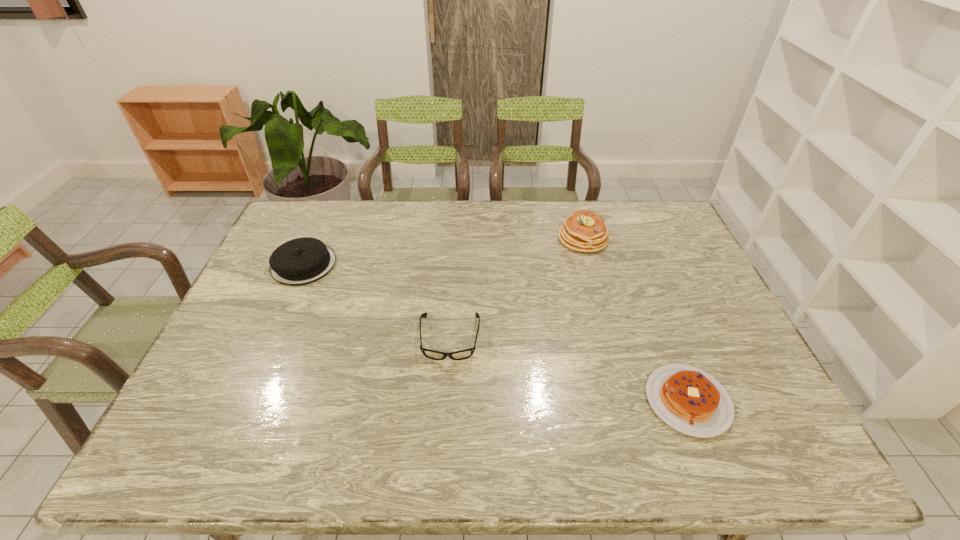
The width and height of the screenshot is (960, 540). I want to click on free space located 0.380m on the back of the shortest pancake, so click(x=636, y=268).

Identify the location of object that is at the far edge. (585, 231).

This screenshot has height=540, width=960. Identify the location of object positioned at the near edge. (691, 401).

Identify the location of object positioned at the left edge. Image resolution: width=960 pixels, height=540 pixels. (300, 261).

What are the coordinates of `object located in the right edge section of the desktop` in the screenshot? It's located at (691, 401).

Identify the location of object situated at the near right corner. The image size is (960, 540). (691, 401).

The height and width of the screenshot is (540, 960). I want to click on free space at the far edge of the desktop, so click(x=481, y=238).

Locate an element on the screen. This screenshot has width=960, height=540. vacant space at the near edge of the desktop is located at coordinates (607, 465).

Identify the location of blank space at the left edge. This screenshot has width=960, height=540. (274, 335).

You are a GUI agent. You are given a task and a screenshot of the screen. Output one action in this format:
    pyautogui.click(x=<x>, y=<y>)
    Task: Click on the vacant space at the right edge of the desktop
    
    Given the screenshot: What is the action you would take?
    pyautogui.click(x=673, y=262)